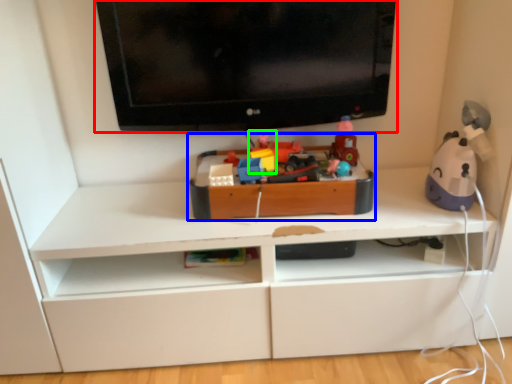
Question: Considering the real-world distances, which object is closest to television (highlighted by a red box)? toy (highlighted by a blue box) or toy (highlighted by a green box).

Choices:
 (A) toy
 (B) toy

Answer: (A)